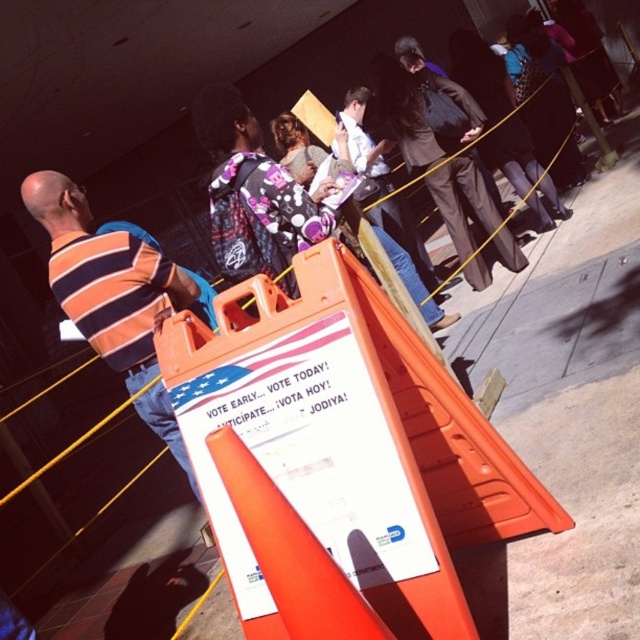
Question: Is orange striped shirt at left closer to the viewer compared to orange plastic traffic cone at center?

Choices:
 (A) no
 (B) yes

Answer: (A)

Question: Which object is farther from the camera taking this photo?

Choices:
 (A) orange plastic traffic cone at center
 (B) orange striped shirt at left

Answer: (B)

Question: From the image, what is the correct spatial relationship of orange striped shirt at left in relation to orange plastic traffic cone at center?

Choices:
 (A) below
 (B) above

Answer: (B)

Question: Is orange striped shirt at left further to camera compared to orange plastic traffic cone at center?

Choices:
 (A) no
 (B) yes

Answer: (B)